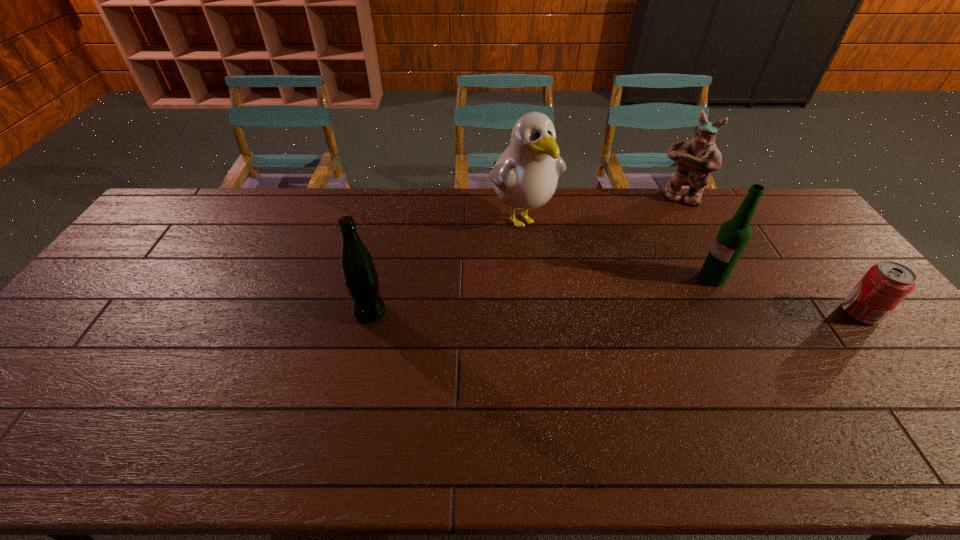
Identify the location of the left beer bottle. This screenshot has height=540, width=960. (361, 279).

At what (x,y) coordinates should I click in order to perform the action: click on the nearer beer bottle. Please return your answer as a coordinate pair (x, y). The width and height of the screenshot is (960, 540). Looking at the image, I should click on (361, 279).

At what (x,y) coordinates should I click in order to perform the action: click on the shortest object. Please return your answer as a coordinate pair (x, y). Looking at the image, I should click on (886, 284).

Image resolution: width=960 pixels, height=540 pixels. I want to click on the rightmost object, so [x=886, y=284].

Locate an element on the screen. The image size is (960, 540). figurine is located at coordinates (696, 159).

Locate an element on the screen. The image size is (960, 540). the fourth object from right to left is located at coordinates (525, 176).

Identify the location of gull. (525, 176).

At what (x,y) coordinates should I click in order to perform the action: click on the third farthest object. Please return your answer as a coordinate pair (x, y). The image size is (960, 540). Looking at the image, I should click on (733, 236).

Where is `the right beer bottle`? The image size is (960, 540). the right beer bottle is located at coordinates (733, 236).

Where is `blank area located on the left of the left beer bottle`? blank area located on the left of the left beer bottle is located at coordinates (267, 313).